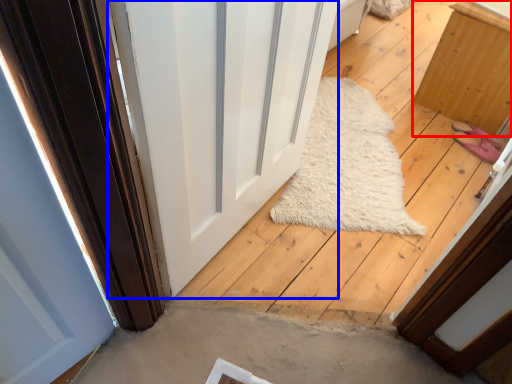
Question: Which object appears farthest to the camera in this image, furniture (highlighted by a red box) or door (highlighted by a blue box)?

Choices:
 (A) furniture
 (B) door

Answer: (A)